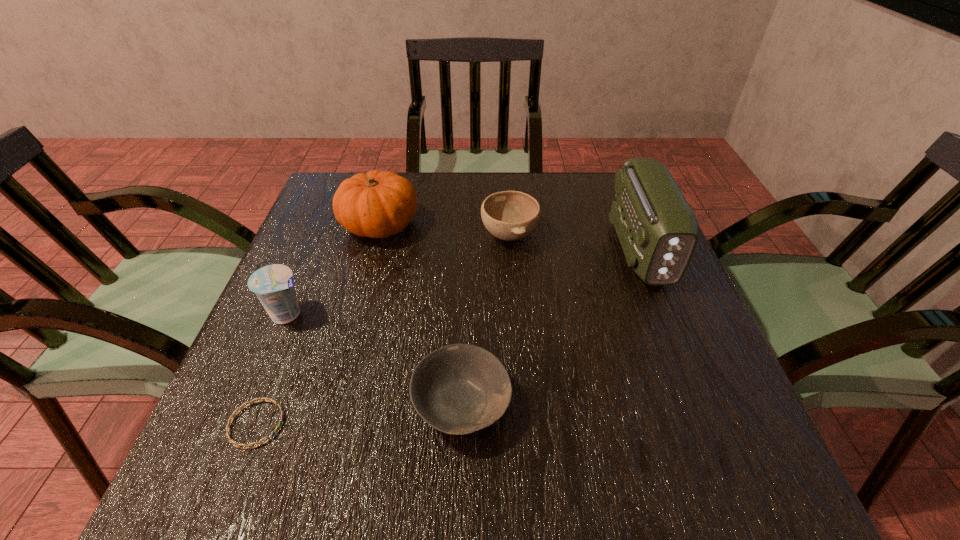
I want to click on vacant area at the left edge of the desktop, so click(338, 249).

At what (x,y) coordinates should I click in order to perform the action: click on free region at the right edge of the desktop. Please return your answer as a coordinate pair (x, y). The image size is (960, 540). Looking at the image, I should click on (680, 365).

The width and height of the screenshot is (960, 540). In the image, there is a desktop. What are the coordinates of `free space at the near left corner` in the screenshot? It's located at (229, 444).

In the image, there is a desktop. Where is `vacant space at the far right corner`? vacant space at the far right corner is located at coordinates (595, 194).

Locate an element on the screen. Image resolution: width=960 pixels, height=540 pixels. blank region between the shortest object and the fourth farthest object is located at coordinates pyautogui.click(x=273, y=369).

At what (x,y) coordinates should I click in order to perform the action: click on vacant space in between the fifth shortest object and the fourth shortest object. Please return your answer as a coordinate pair (x, y). The height and width of the screenshot is (540, 960). Looking at the image, I should click on (334, 269).

You are a GUI agent. You are given a task and a screenshot of the screen. Output one action in this format:
    pyautogui.click(x=<x>, y=<y>)
    Task: Click on the free space that is in between the third nearest object and the tallest object
    Image resolution: width=960 pixels, height=540 pixels.
    Given the screenshot: What is the action you would take?
    pyautogui.click(x=464, y=281)

The height and width of the screenshot is (540, 960). In order to click on vacant point located between the fourth farthest object and the radio_receiver in this screenshot , I will do `click(464, 281)`.

Locate an element on the screen. Image resolution: width=960 pixels, height=540 pixels. vacant region between the nearer bowl and the third tallest object is located at coordinates (375, 359).

At what (x,y) coordinates should I click in order to perform the action: click on vacant region between the shorter bowl and the tallest object. Please return your answer as a coordinate pair (x, y). The image size is (960, 540). Looking at the image, I should click on click(x=551, y=327).